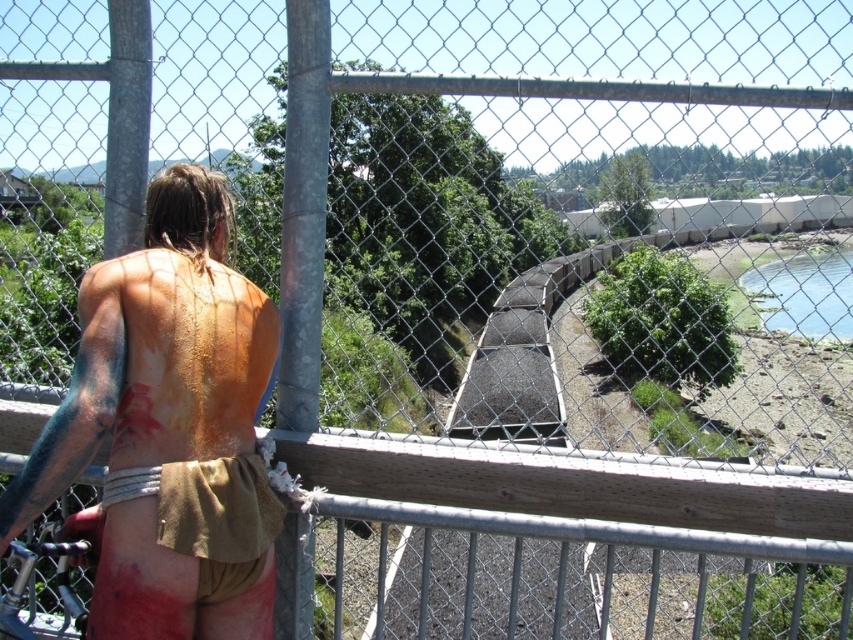
Can you confirm if brown leather shorts at left is wider than green grassy river at lower right?

Incorrect, brown leather shorts at left's width does not surpass green grassy river at lower right's.

Who is more forward, (207, 604) or (807, 276)?

Point (207, 604) is in front.

The height and width of the screenshot is (640, 853). I want to click on brown leather shorts at left, so click(x=167, y=428).